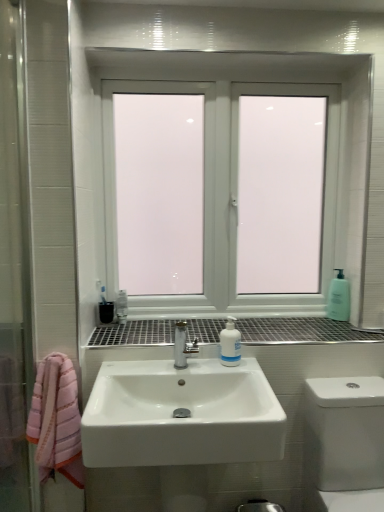
Question: Is translucent plastic soap dispenser at right facing away from white glossy sink at center?

Choices:
 (A) no
 (B) yes

Answer: (A)

Question: Is the position of translucent plastic soap dispenser at right less distant than that of white glossy sink at center?

Choices:
 (A) no
 (B) yes

Answer: (A)

Question: Does translucent plastic soap dispenser at right have a greater width compared to white glossy sink at center?

Choices:
 (A) yes
 (B) no

Answer: (B)

Question: Is translucent plastic soap dispenser at right positioned far away from white glossy sink at center?

Choices:
 (A) yes
 (B) no

Answer: (B)

Question: From a real-world perspective, is translucent plastic soap dispenser at right under white glossy sink at center?

Choices:
 (A) no
 (B) yes

Answer: (A)

Question: Is point (299, 317) positioned closer to the camera than point (256, 366)?

Choices:
 (A) closer
 (B) farther

Answer: (B)

Question: Is metallic grid at center wider or thinner than white glossy sink at center?

Choices:
 (A) thin
 (B) wide

Answer: (A)

Question: Considering the positions of metallic grid at center and white glossy sink at center in the image, is metallic grid at center bigger or smaller than white glossy sink at center?

Choices:
 (A) big
 (B) small

Answer: (B)

Question: From a real-world perspective, relative to white glossy sink at center, is metallic grid at center vertically above or below?

Choices:
 (A) below
 (B) above

Answer: (B)

Question: Is translucent plastic soap dispenser at right in front of or behind white glossy toilet at lower right in the image?

Choices:
 (A) front
 (B) behind

Answer: (B)

Question: Is point (337, 309) closer or farther from the camera than point (306, 463)?

Choices:
 (A) farther
 (B) closer

Answer: (A)

Question: From the image's perspective, is translucent plastic soap dispenser at right positioned above or below white glossy toilet at lower right?

Choices:
 (A) below
 (B) above

Answer: (B)

Question: Is translucent plastic soap dispenser at right bigger or smaller than white glossy toilet at lower right?

Choices:
 (A) small
 (B) big

Answer: (A)

Question: Relative to white glossy toilet at lower right, is metallic grid at center in front or behind?

Choices:
 (A) behind
 (B) front

Answer: (A)

Question: In the image, is metallic grid at center on the left side or the right side of white glossy toilet at lower right?

Choices:
 (A) left
 (B) right

Answer: (A)